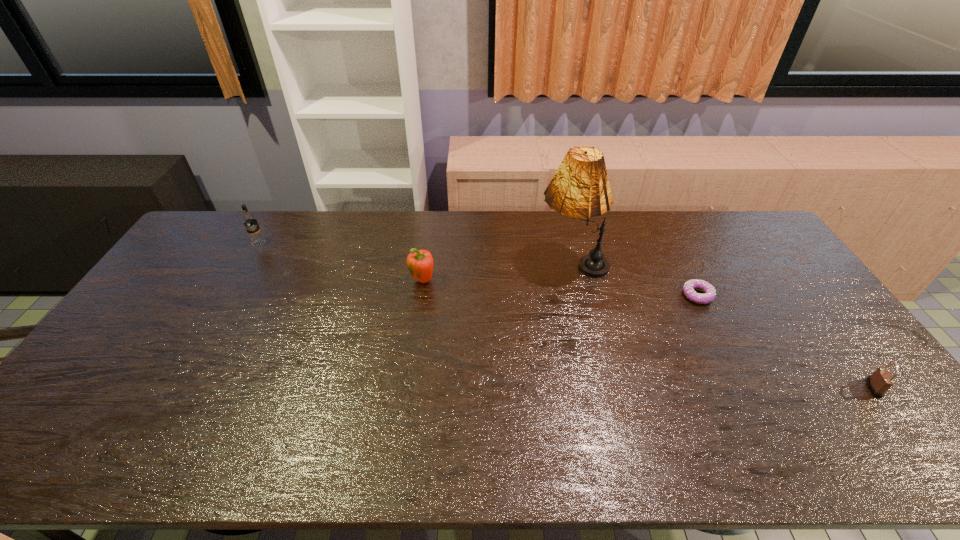
At what (x,y) coordinates should I click in order to perform the action: click on vacant space located 0.130m on the front-facing side of the third object from right to left. Please return your answer as a coordinate pair (x, y). Looking at the image, I should click on (498, 263).

The height and width of the screenshot is (540, 960). Identify the location of free space located on the front-facing side of the third object from right to left. (436, 263).

Where is `free space located 0.050m on the label of the vodka`? The width and height of the screenshot is (960, 540). free space located 0.050m on the label of the vodka is located at coordinates (252, 257).

The height and width of the screenshot is (540, 960). I want to click on free space located on the front of the third shortest object, so click(x=417, y=325).

Locate an element on the screen. The width and height of the screenshot is (960, 540). vacant region located on the front of the nearest object is located at coordinates (904, 428).

This screenshot has height=540, width=960. Identify the location of vacant space located 0.250m on the back of the doughnut. (668, 237).

Find the location of a particular element. lampshade present at the far edge is located at coordinates (580, 188).

At what (x,y) coordinates should I click in order to perform the action: click on vodka positioned at the far edge. Please return your answer as a coordinate pair (x, y). The height and width of the screenshot is (540, 960). Looking at the image, I should click on (249, 220).

At what (x,y) coordinates should I click in order to perform the action: click on object that is at the right edge. Please return your answer as a coordinate pair (x, y). Looking at the image, I should click on (881, 380).

Locate an element on the screen. The image size is (960, 540). free space at the far edge of the desktop is located at coordinates (431, 214).